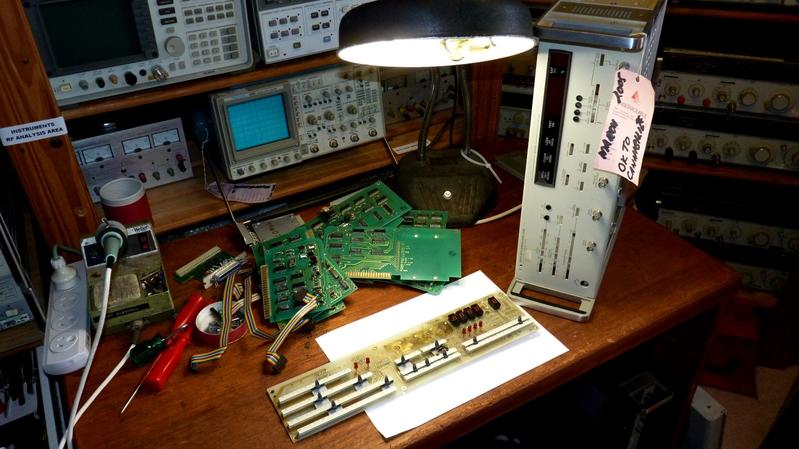
The height and width of the screenshot is (449, 799). I want to click on cord, so click(x=505, y=214).